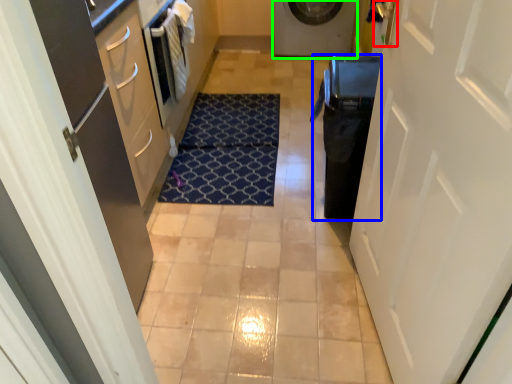
Question: Considering the real-world distances, which object is closest to door handle (highlighted by a red box)? dish washer (highlighted by a blue box) or washing machine (highlighted by a green box).

Choices:
 (A) dish washer
 (B) washing machine

Answer: (A)